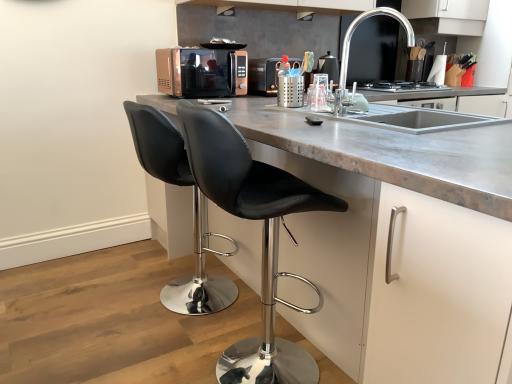
Find the location of a particular element. This screenshot has width=512, height=384. free space to the left of black leather stool at lower left, positioned as the 1th chair in back-to-front order is located at coordinates [95, 304].